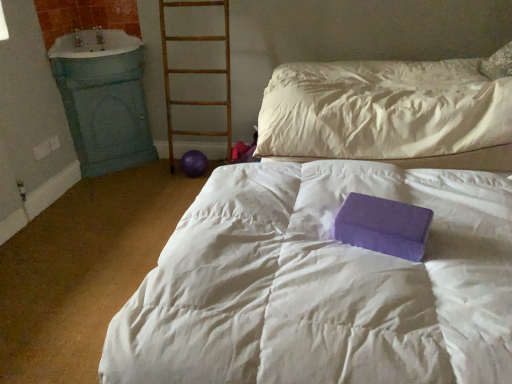
Question: Is purple foam block at center shorter than blue painted wood sink at left?

Choices:
 (A) yes
 (B) no

Answer: (A)

Question: Does purple foam block at center lie in front of blue painted wood sink at left?

Choices:
 (A) yes
 (B) no

Answer: (A)

Question: Considering the relative positions of purple foam block at center and blue painted wood sink at left in the image provided, is purple foam block at center behind blue painted wood sink at left?

Choices:
 (A) yes
 (B) no

Answer: (B)

Question: From a real-world perspective, is purple foam block at center physically below blue painted wood sink at left?

Choices:
 (A) no
 (B) yes

Answer: (B)

Question: Does purple foam block at center have a lesser width compared to blue painted wood sink at left?

Choices:
 (A) yes
 (B) no

Answer: (B)

Question: Is blue painted wood sink at left a part of purple foam block at center?

Choices:
 (A) yes
 (B) no

Answer: (B)

Question: Is wooden ladder at center located within blue painted wood sink at left?

Choices:
 (A) no
 (B) yes

Answer: (A)

Question: Is blue painted wood sink at left taller than wooden ladder at center?

Choices:
 (A) no
 (B) yes

Answer: (A)

Question: Considering the relative positions of blue painted wood sink at left and wooden ladder at center in the image provided, is blue painted wood sink at left behind wooden ladder at center?

Choices:
 (A) yes
 (B) no

Answer: (B)

Question: From a real-world perspective, is blue painted wood sink at left positioned over wooden ladder at center based on gravity?

Choices:
 (A) no
 (B) yes

Answer: (B)

Question: Can you confirm if blue painted wood sink at left is smaller than wooden ladder at center?

Choices:
 (A) no
 (B) yes

Answer: (B)

Question: Does blue painted wood sink at left appear on the left side of wooden ladder at center?

Choices:
 (A) yes
 (B) no

Answer: (A)

Question: Can you confirm if purple foam block at center is thinner than purple matte foam block at center?

Choices:
 (A) yes
 (B) no

Answer: (B)